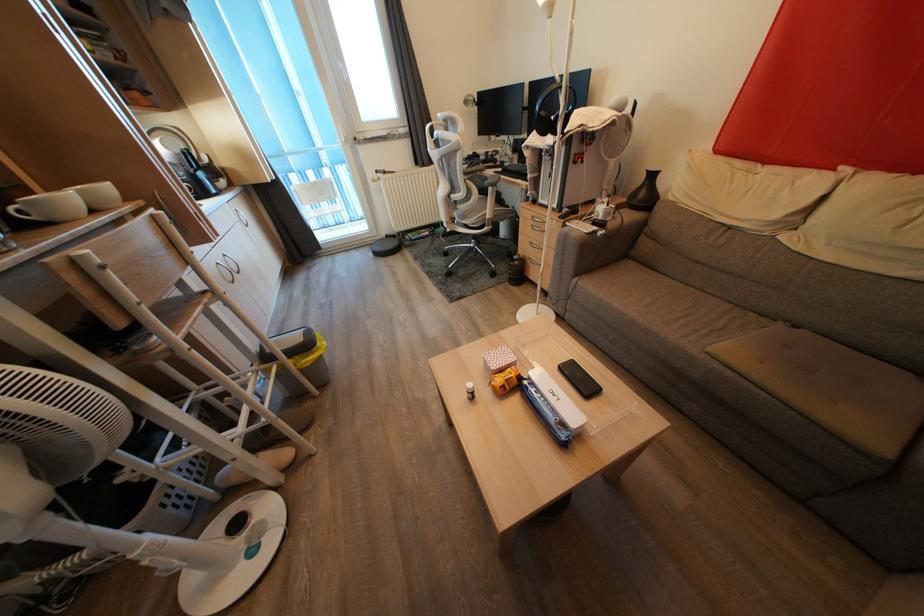
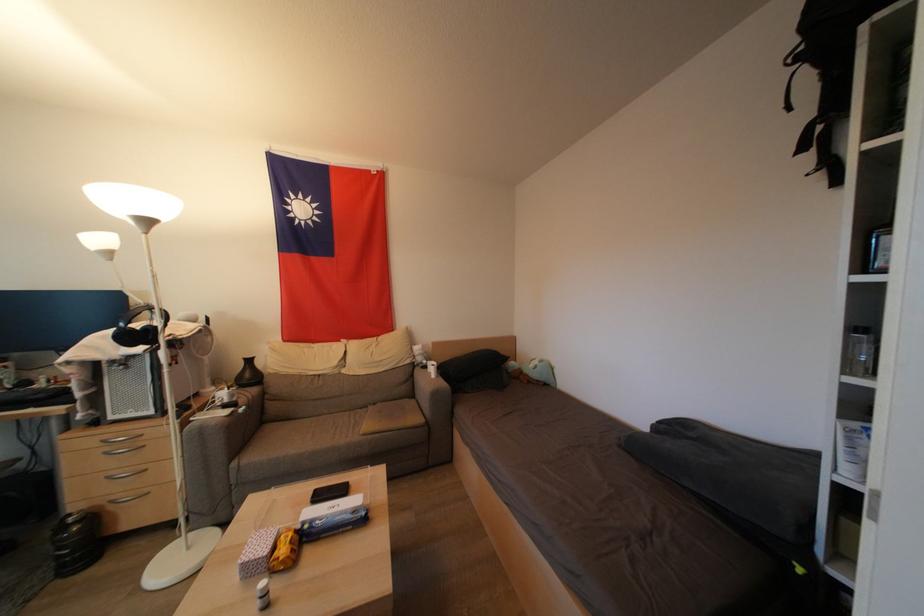
Question: I am providing you with two images of the same scene from different viewpoints. Which of the following objects are not visible in image2?

Choices:
 (A) glass jar
 (B) drawer handle
 (C) black bed pillow
 (D) none of these

Answer: (D)